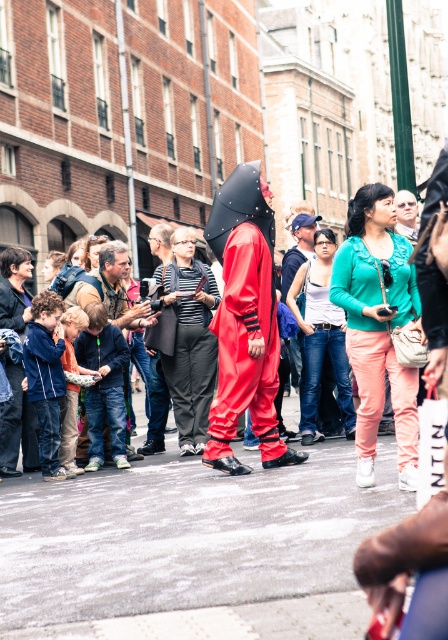
Question: Can you confirm if matte red suit at center is thinner than denim jacket at center?

Choices:
 (A) no
 (B) yes

Answer: (A)

Question: Which point is farther to the camera?

Choices:
 (A) (399, 237)
 (B) (224, 387)
 (C) (103, 275)
 (D) (294, 252)

Answer: (D)

Question: Considering the real-world distances, which object is closest to the teal matte blouse at center?

Choices:
 (A) denim jacket at center
 (B) matte red suit at center

Answer: (B)

Question: Estimate the real-world distances between objects in this image. Which object is closer to the teal matte blouse at center?

Choices:
 (A) matte red suit at center
 (B) denim jacket at center
 (C) striped fabric jacket at center
 (D) shiny red jumpsuit at center

Answer: (D)

Question: Can you confirm if striped fabric jacket at center is smaller than matte black umbrella at center?

Choices:
 (A) yes
 (B) no

Answer: (A)

Question: From the image, what is the correct spatial relationship of striped fabric jacket at center in relation to denim jacket at center?

Choices:
 (A) below
 (B) above

Answer: (A)